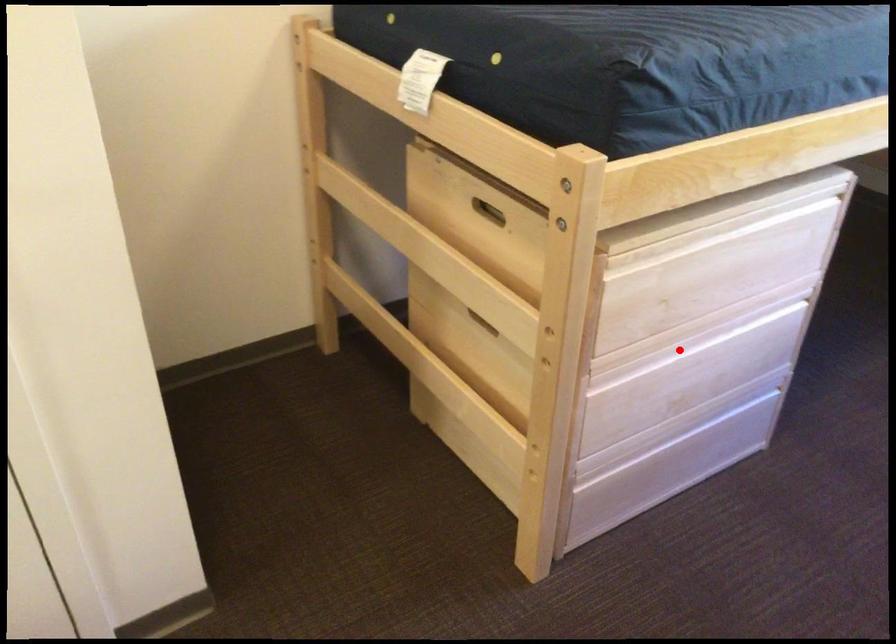
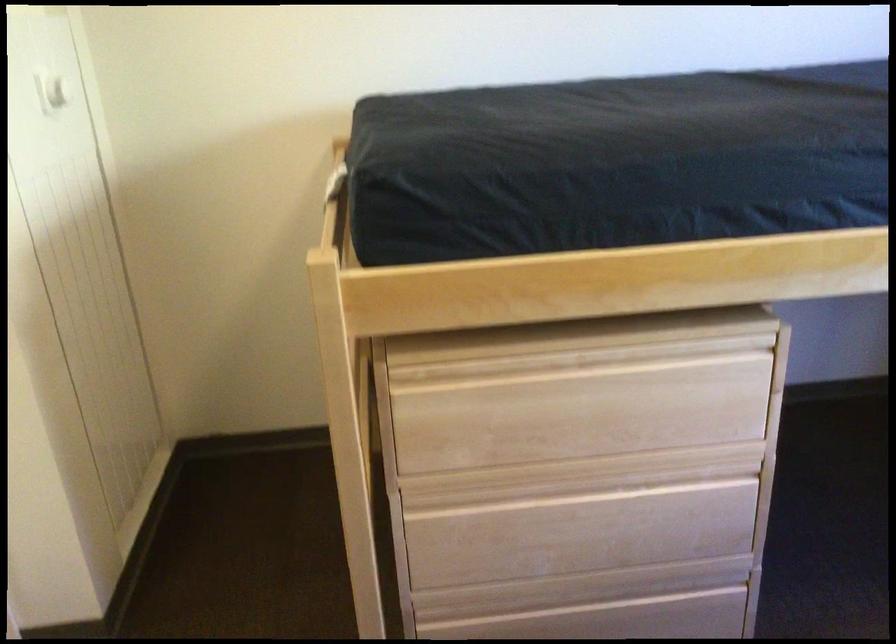
The point at the highlighted location is marked in the first image. Where is the corresponding point in the second image?

(546, 491)